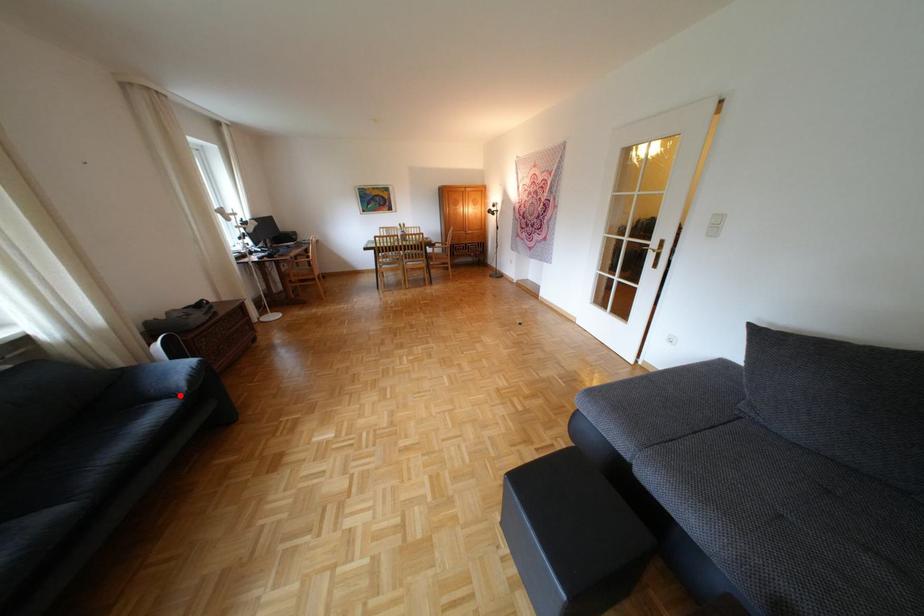
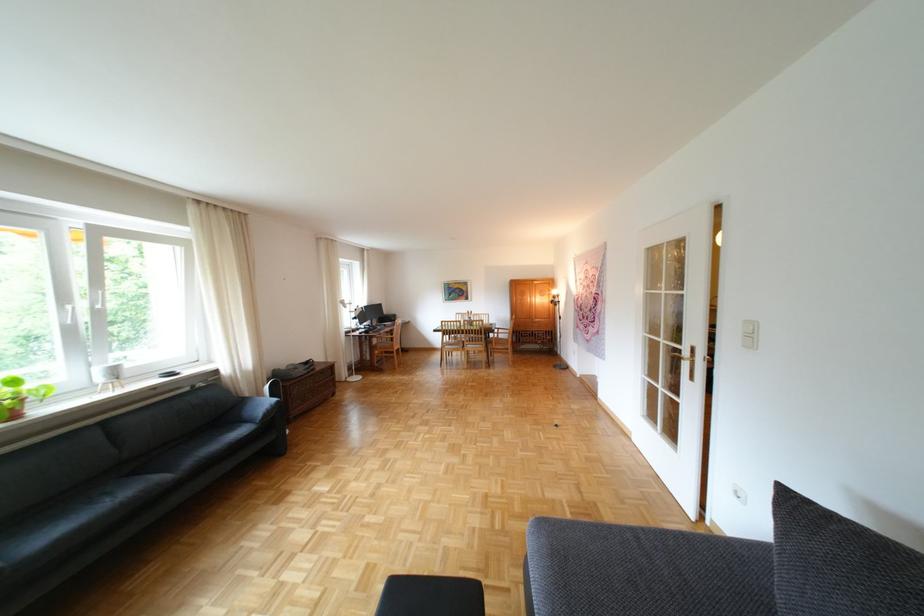
The point at the highlighted location is marked in the first image. Where is the corresponding point in the second image?

(263, 421)